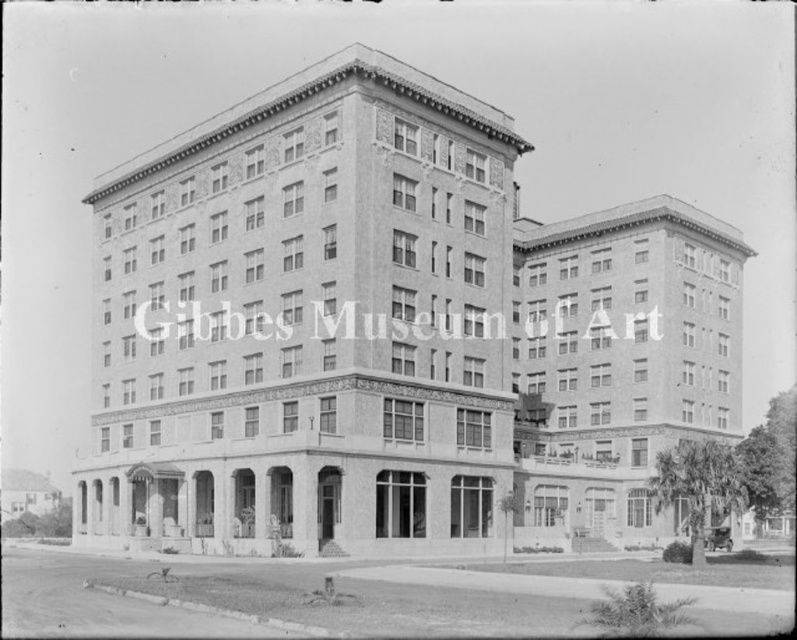
Is smooth stone building at center taller than brick textured building at center?

Yes, smooth stone building at center is taller than brick textured building at center.

Does smooth stone building at center have a larger size compared to brick textured building at center?

Yes.

Between point (313, 288) and point (635, 500), which one is positioned in front?

Point (313, 288) is more forward.

The image size is (797, 640). What are the coordinates of `smooth stone building at center` in the screenshot? It's located at (389, 333).